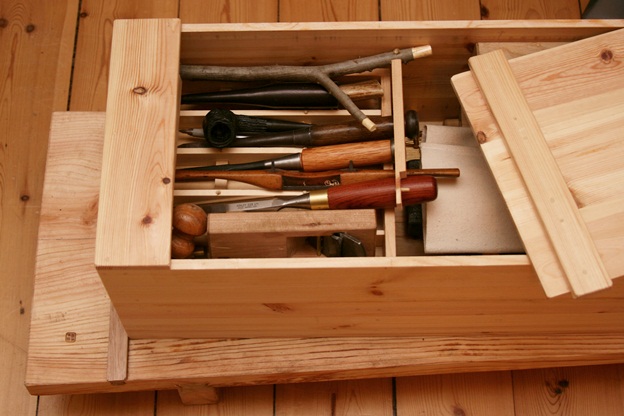
At what (x,y) coordinates should I click in order to perform the action: click on wooden strip. Please return your answer as a coordinate pair (x, y). The width and height of the screenshot is (624, 416). Looking at the image, I should click on tap(115, 362), tap(115, 330), tap(580, 256), tap(547, 188), tap(515, 133), tap(493, 72).